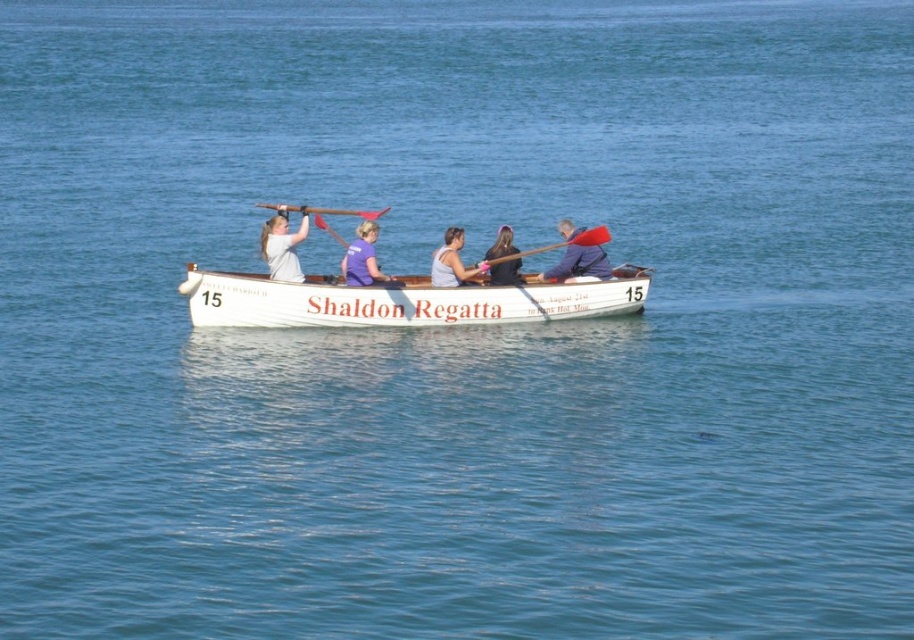
Is point (373, 282) positioned before point (445, 260)?

That is False.

Between point (344, 260) and point (447, 266), which one is positioned in front?

Point (447, 266) is in front.

Image resolution: width=914 pixels, height=640 pixels. Find the location of `purple fabric shirt at center`. purple fabric shirt at center is located at coordinates (362, 259).

Consider the image. Does white polished wood canoe at center appear on the right side of matte gray tank top at center?

No, white polished wood canoe at center is not to the right of matte gray tank top at center.

Is point (370, 285) positioned after point (452, 244)?

No, (370, 285) is closer to viewer.

Identify the location of white polished wood canoe at center. (401, 300).

Does red wood paddle at center appear on the left side of brushed metal paddle at upper center?

In fact, red wood paddle at center is to the right of brushed metal paddle at upper center.

Can you confirm if red wood paddle at center is positioned below brushed metal paddle at upper center?

Indeed, red wood paddle at center is positioned under brushed metal paddle at upper center.

Is point (590, 234) closer to camera compared to point (370, 211)?

Yes, point (590, 234) is in front of point (370, 211).

Identify the location of red wood paddle at center. The image size is (914, 640). (561, 243).